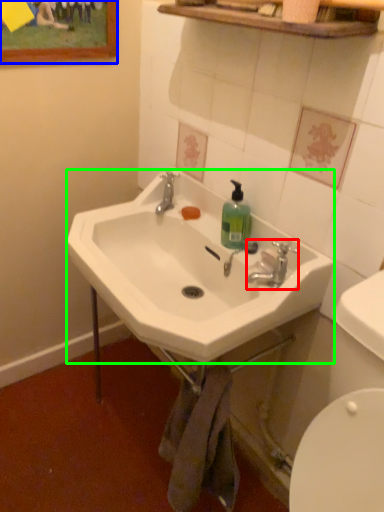
Question: Considering the real-world distances, which object is farthest from plumbing fixture (highlighted by a red box)? picture frame (highlighted by a blue box) or sink (highlighted by a green box)?

Choices:
 (A) picture frame
 (B) sink

Answer: (A)